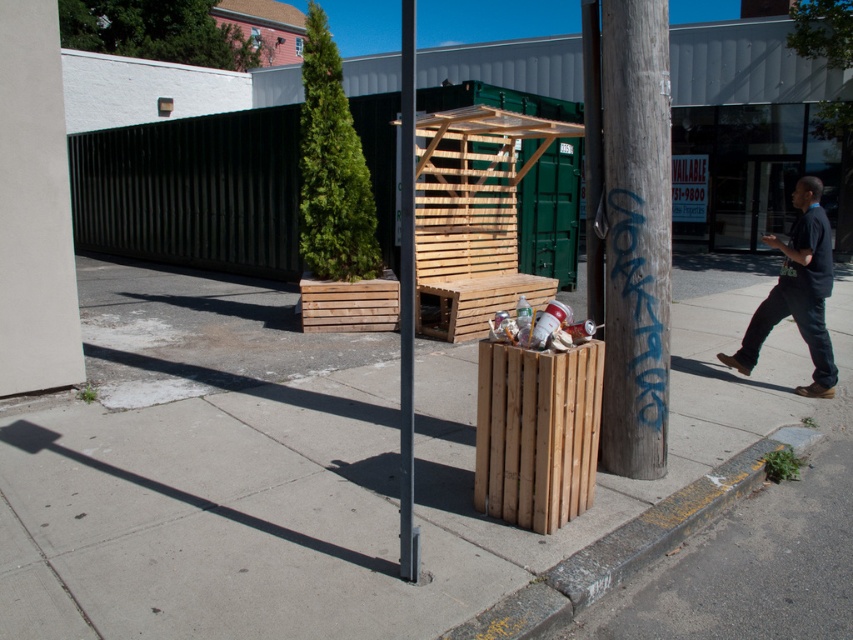
Between weathered wood pole at right and dark blue shirt at right, which one appears on the left side from the viewer's perspective?

weathered wood pole at right is more to the left.

I want to click on weathered wood pole at right, so click(635, 236).

Can you confirm if concrete curb at lower right is shorter than dark blue shirt at right?

Yes, concrete curb at lower right is shorter than dark blue shirt at right.

Is concrete curb at lower right to the right of dark blue shirt at right from the viewer's perspective?

Incorrect, concrete curb at lower right is not on the right side of dark blue shirt at right.

Measure the distance between point (608, 544) and camera.

The distance of point (608, 544) from camera is 11.92 feet.

Where is `concrete curb at lower right`? This screenshot has width=853, height=640. concrete curb at lower right is located at coordinates (627, 547).

Between point (239, 536) and point (618, 417), which one is positioned in front?

Point (239, 536) is more forward.

Which is in front, point (76, 454) or point (660, 61)?

Positioned in front is point (660, 61).

Find the location of a particular element. Image resolution: width=853 pixels, height=640 pixels. wooden crate at center is located at coordinates (326, 486).